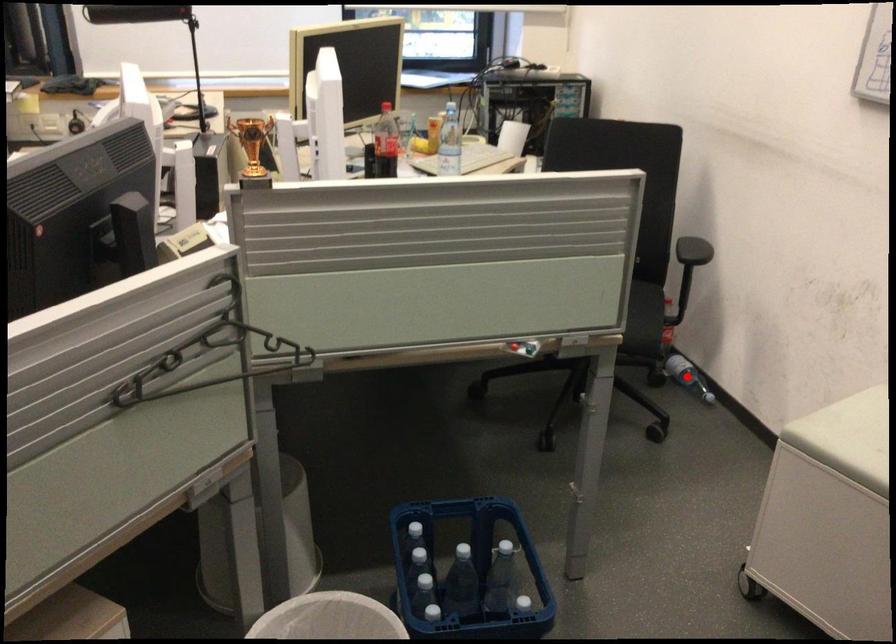
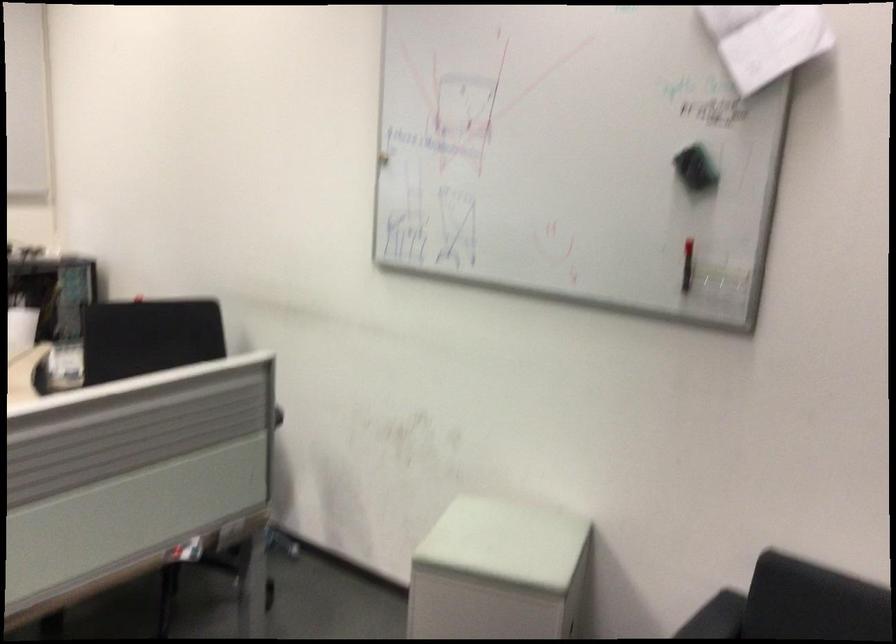
Where in the second image is the point corresponding to the highlighted location from the first image?

(264, 535)